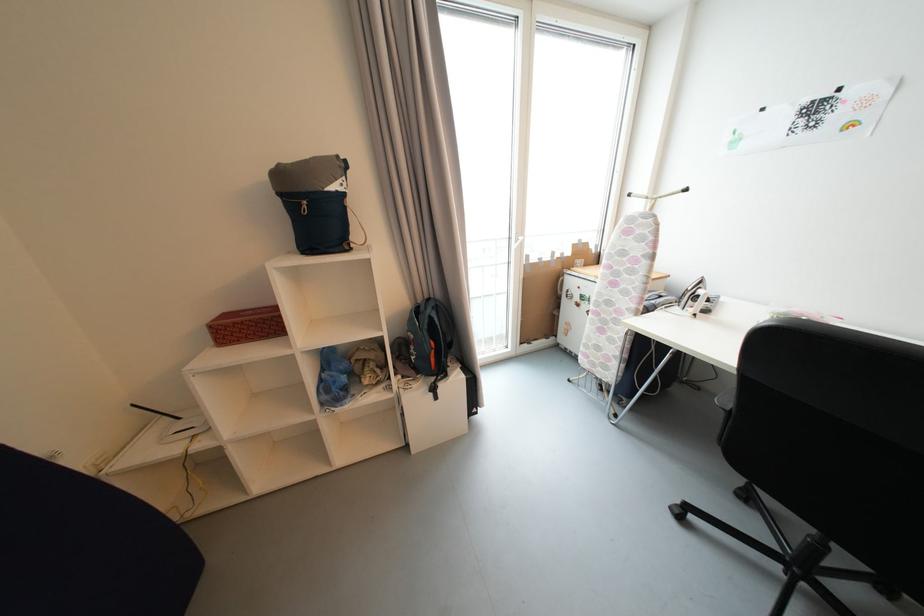
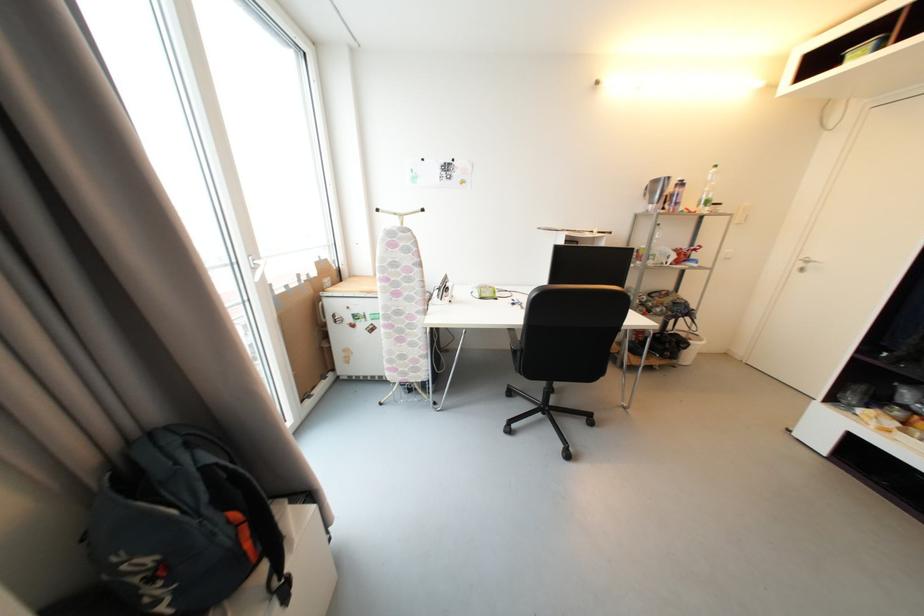
Where in the second image is the point corresponding to [438,362] from the first image?

(253, 546)